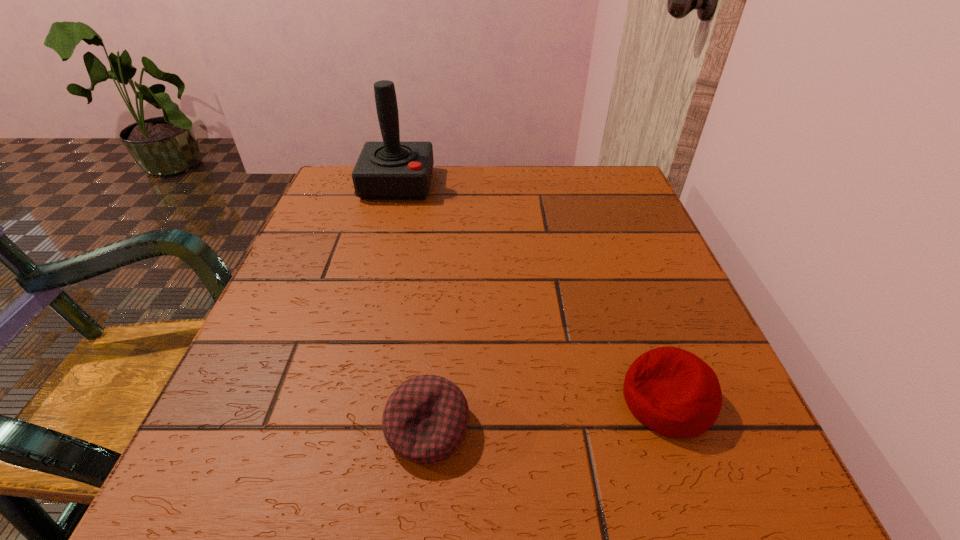
Identify the location of free space between the joystick and the left beanbag. (413, 306).

This screenshot has height=540, width=960. I want to click on free spot between the rightmost object and the left beanbag, so click(x=547, y=414).

You are a GUI agent. You are given a task and a screenshot of the screen. Output one action in this format:
    pyautogui.click(x=<x>, y=<y>)
    Task: Click on the vacant space in between the right beanbag and the left beanbag
    The height and width of the screenshot is (540, 960).
    Given the screenshot: What is the action you would take?
    pyautogui.click(x=547, y=414)

Identify the location of vacant space that's between the left beanbag and the tallest object. (413, 306).

Locate an element on the screen. vacant space that is in between the left beanbag and the rightmost object is located at coordinates (547, 414).

Locate an element on the screen. blank region between the left beanbag and the rightmost object is located at coordinates (547, 414).

Find the location of a particular element. The height and width of the screenshot is (540, 960). empty space between the rightmost object and the tallest object is located at coordinates (533, 292).

Where is `free spot between the right beanbag and the left beanbag`? The width and height of the screenshot is (960, 540). free spot between the right beanbag and the left beanbag is located at coordinates (547, 414).

Identify the location of vacant area between the left beanbag and the rightmost object. The height and width of the screenshot is (540, 960). (547, 414).

Locate an element on the screen. vacant area that lies between the rightmost object and the left beanbag is located at coordinates (547, 414).